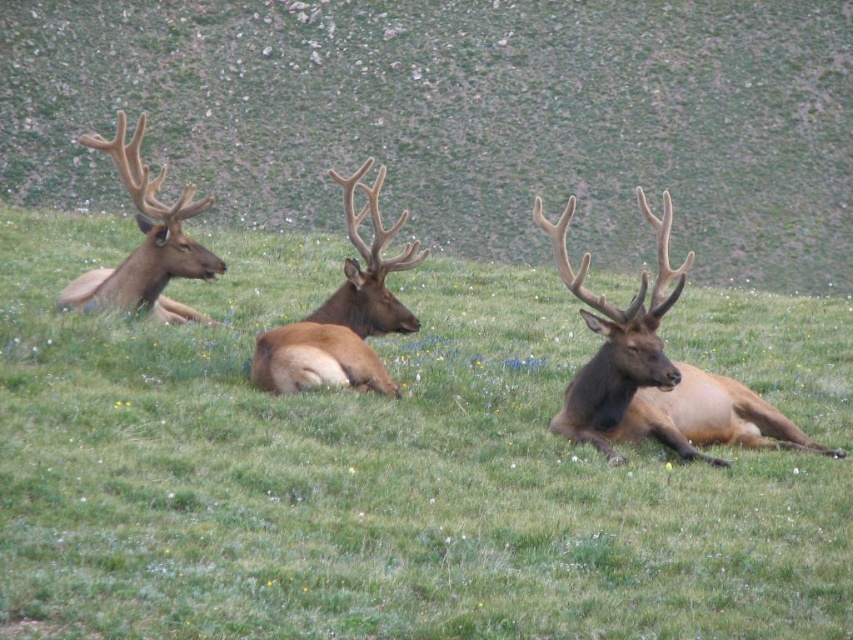
Does brown velvet elk at center appear on the right side of brown velvet antler at center?

No, brown velvet elk at center is not to the right of brown velvet antler at center.

From the picture: Is brown velvet elk at center thinner than brown velvet antler at center?

Incorrect, brown velvet elk at center's width is not less than brown velvet antler at center's.

Which is behind, point (488, 104) or point (360, 168)?

Positioned behind is point (488, 104).

The width and height of the screenshot is (853, 640). What are the coordinates of `brown velvet elk at center` in the screenshot? It's located at (461, 116).

Is point (366, 328) positioned after point (149, 182)?

No.

Measure the distance between point (280, 340) and camera.

A distance of 7.75 meters exists between point (280, 340) and camera.

Where is `brown velvet antler at center`? The width and height of the screenshot is (853, 640). brown velvet antler at center is located at coordinates (343, 314).

Is green grass at center taller than brown velvet elk at center?

Incorrect, green grass at center's height is not larger of brown velvet elk at center's.

Does green grass at center have a lesser width compared to brown velvet elk at center?

Yes, green grass at center is thinner than brown velvet elk at center.

Where is `green grass at center`? The height and width of the screenshot is (640, 853). green grass at center is located at coordinates (396, 465).